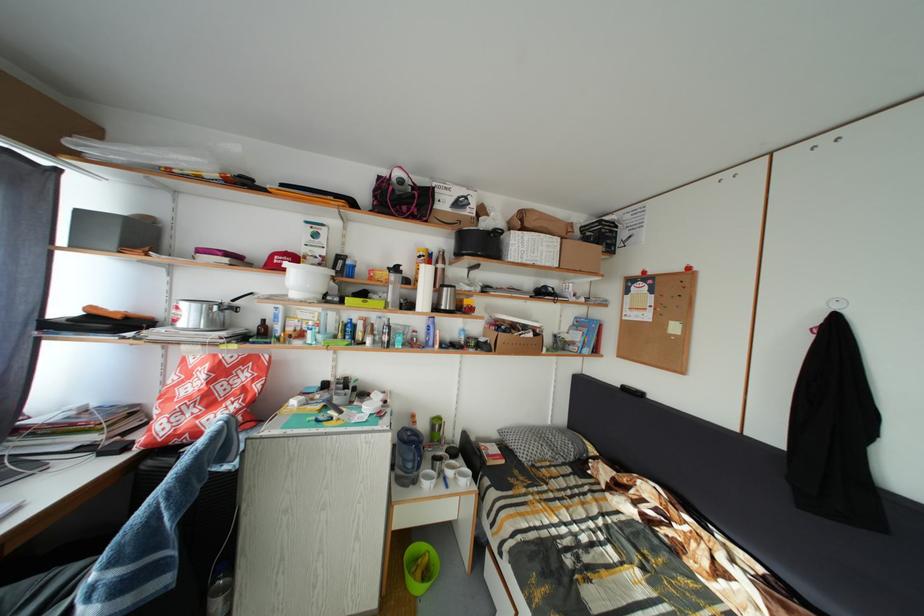
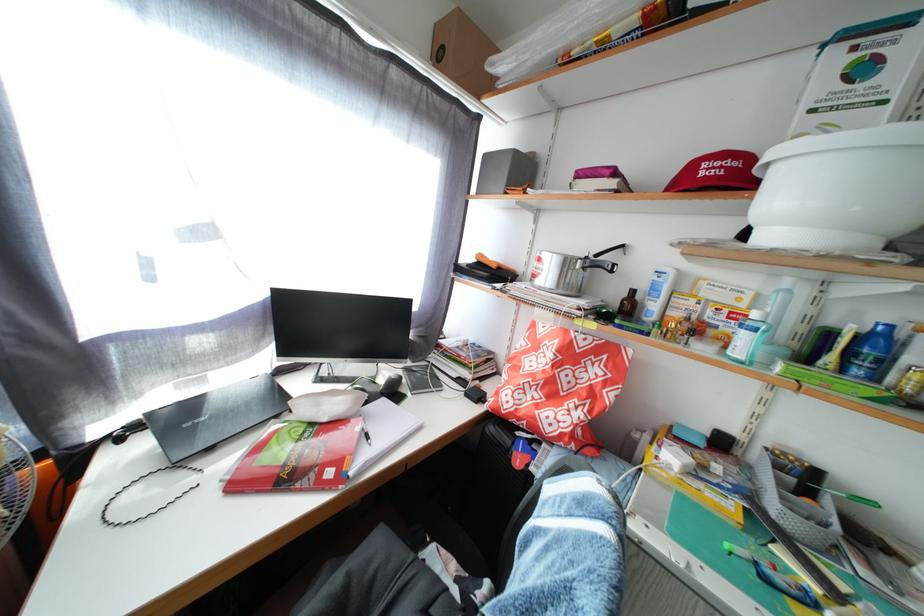
In the second image, find the point that corresponds to (357,344) in the first image.

(866, 378)